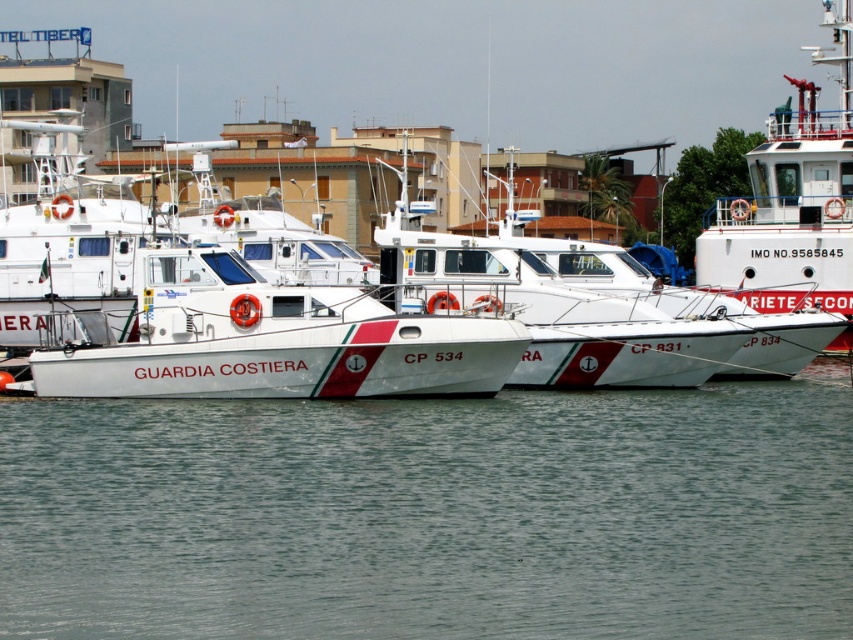
Does white glossy boat at center appear on the right side of white matte ship at upper right?

In fact, white glossy boat at center is to the left of white matte ship at upper right.

Consider the image. Can you confirm if white glossy boat at center is positioned below white matte ship at upper right?

Yes.

Between point (618, 348) and point (723, 227), which one is positioned in front?

Positioned in front is point (618, 348).

You are a GUI agent. You are given a task and a screenshot of the screen. Output one action in this format:
    pyautogui.click(x=<x>, y=<y>)
    Task: Click on the white glossy boat at center
    
    Given the screenshot: What is the action you would take?
    pyautogui.click(x=598, y=312)

How much distance is there between clear water at center and white matte ship at upper right?

clear water at center and white matte ship at upper right are 102.76 feet apart from each other.

Is clear water at center thinner than white matte ship at upper right?

Indeed, clear water at center has a lesser width compared to white matte ship at upper right.

Which is behind, point (733, 442) or point (807, 125)?

The point (807, 125) is behind.

Identify the location of clear water at center. (433, 515).

Between clear water at center and white glossy boat at center, which one has less height?

With less height is clear water at center.

Is clear water at center bigger than white glossy boat at center?

Incorrect, clear water at center is not larger than white glossy boat at center.

At what (x,y) coordinates should I click in order to perform the action: click on clear water at center. Please return your answer as a coordinate pair (x, y). Image resolution: width=853 pixels, height=640 pixels. Looking at the image, I should click on (433, 515).